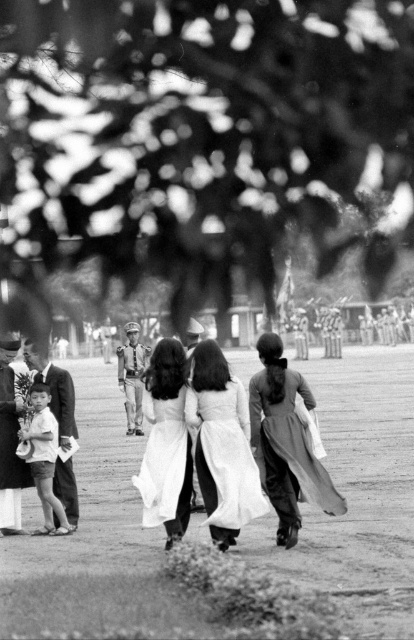
You are a photographer at the event and want to capture a closeup of both the silky white dress at center and the white silk ao dai at center. Since you can only focus on one at a time, which one should you choose to ensure the subject takes up more of the frame?

The silky white dress at center is larger in size than the white silk ao dai at center, so you should focus on the silky white dress at center to ensure it takes up more of the frame.

You are a photographer at the event and want to capture a photo of the silky white dress at center and the white silk ao dai at center. Which one is positioned higher in the image?

The silky white dress at center is located above the white silk ao dai at center, so it is positioned higher in the image.